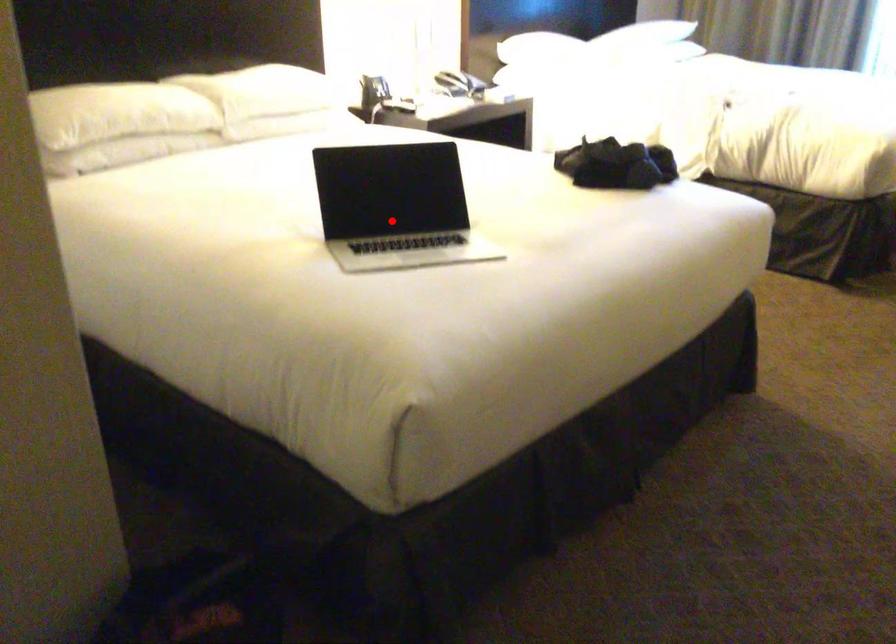
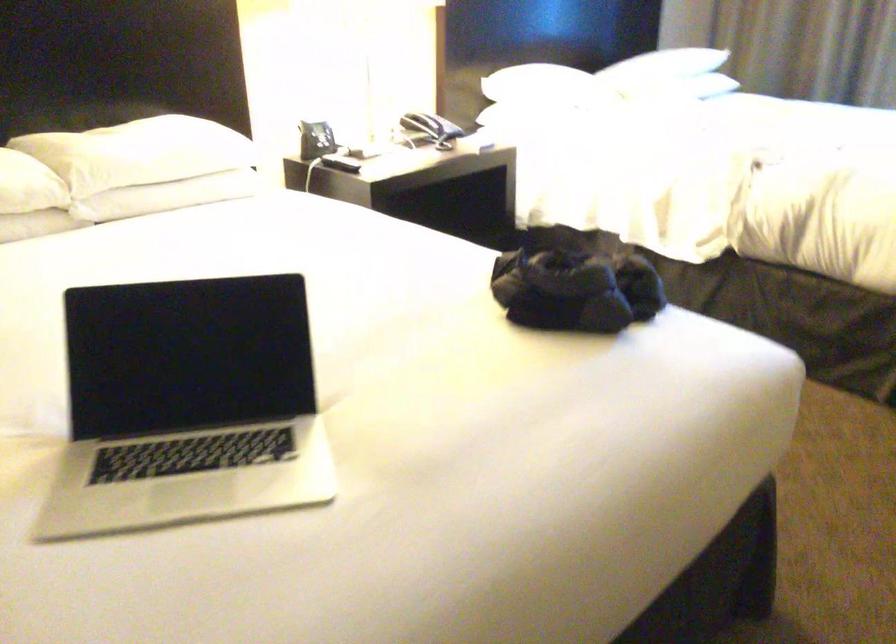
Question: I am providing you with two images of the same scene from different viewpoints. In image1, a red point is highlighted. Considering the same 3D point in image2, which of the following is correct?

Choices:
 (A) It is closer
 (B) It is farther

Answer: (A)